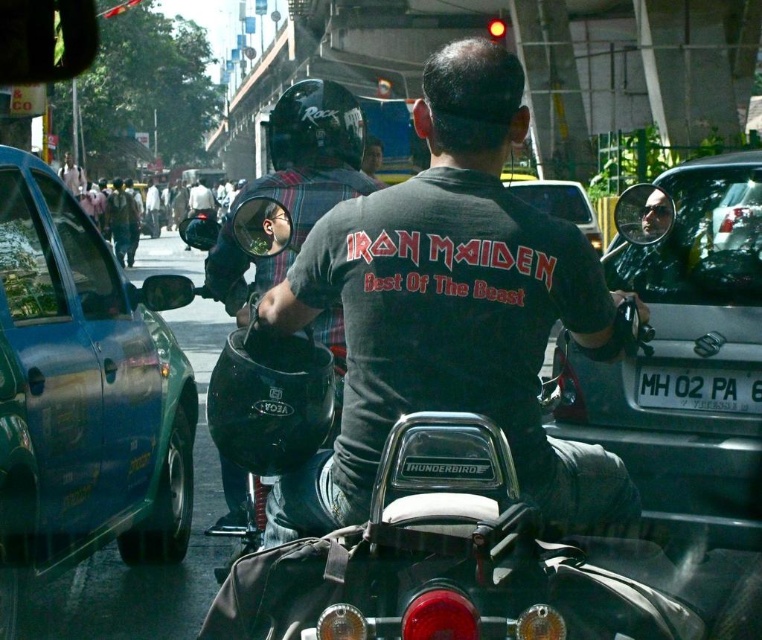
Looking at this image, who is lower down, metallic silver motorcycle at center or white plastic license plate at center?

Positioned lower is metallic silver motorcycle at center.

Can you confirm if metallic silver motorcycle at center is positioned above white plastic license plate at center?

No, metallic silver motorcycle at center is not above white plastic license plate at center.

Is point (732, 604) closer to camera compared to point (671, 403)?

No, (732, 604) is behind (671, 403).

Image resolution: width=762 pixels, height=640 pixels. I want to click on metallic silver motorcycle at center, so click(x=472, y=563).

Between matte black helmet at center and dark gray helmet at center, which one is positioned higher?

dark gray helmet at center is higher up.

At what (x,y) coordinates should I click in order to perform the action: click on matte black helmet at center. Please return your answer as a coordinate pair (x, y). This screenshot has height=640, width=762. Looking at the image, I should click on (293, 182).

You are a GUI agent. You are given a task and a screenshot of the screen. Output one action in this format:
    pyautogui.click(x=<x>, y=<y>)
    Task: Click on the matte black helmet at center
    The width and height of the screenshot is (762, 640).
    Given the screenshot: What is the action you would take?
    coord(293,182)

Can you confirm if matte black helmet at center is smaller than white plastic license plate at center?

Incorrect, matte black helmet at center is not smaller in size than white plastic license plate at center.

Is point (357, 154) positioned after point (642, 381)?

No, (357, 154) is closer to viewer.

What are the coordinates of `matte black helmet at center` in the screenshot? It's located at (293, 182).